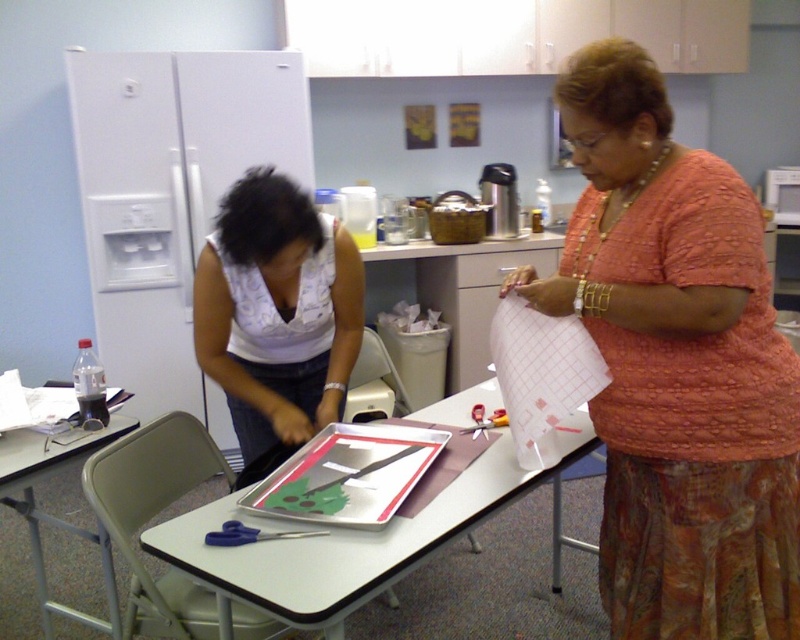
You are a delivery person who needs to place a small package on the table in the image. The package is 15 inches long. Can the white printed shirt at center and the white plastic table at center accommodate the package without overlapping?

The distance between the white printed shirt at center and the white plastic table at center is 16.38 inches. Since the package is 15 inches long, it can fit between them without overlapping.